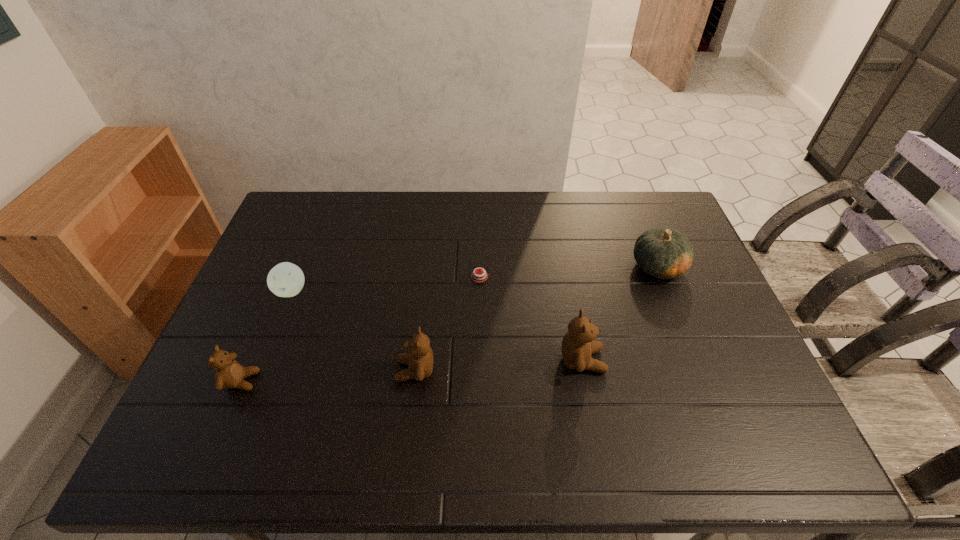
Please point a vacant point for placing a teddy bear on the right. Please provide its 2D coordinates. Your answer should be formatted as a tuple, i.e. [(x, y)], where the tuple contains the x and y coordinates of a point satisfying the conditions above.

[(744, 351)]